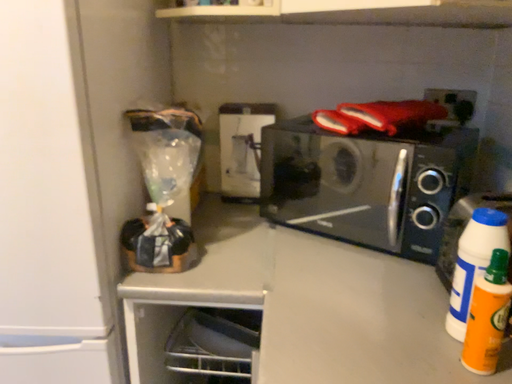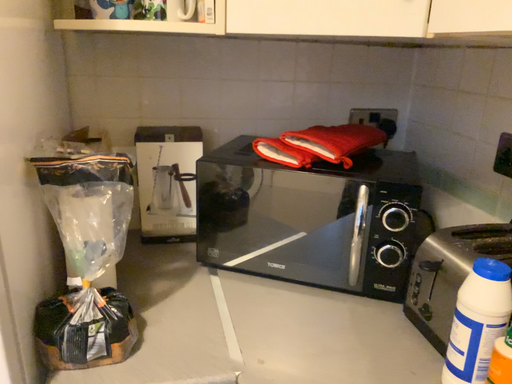
Question: How did the camera likely rotate when shooting the video?

Choices:
 (A) rotated left
 (B) rotated right

Answer: (B)